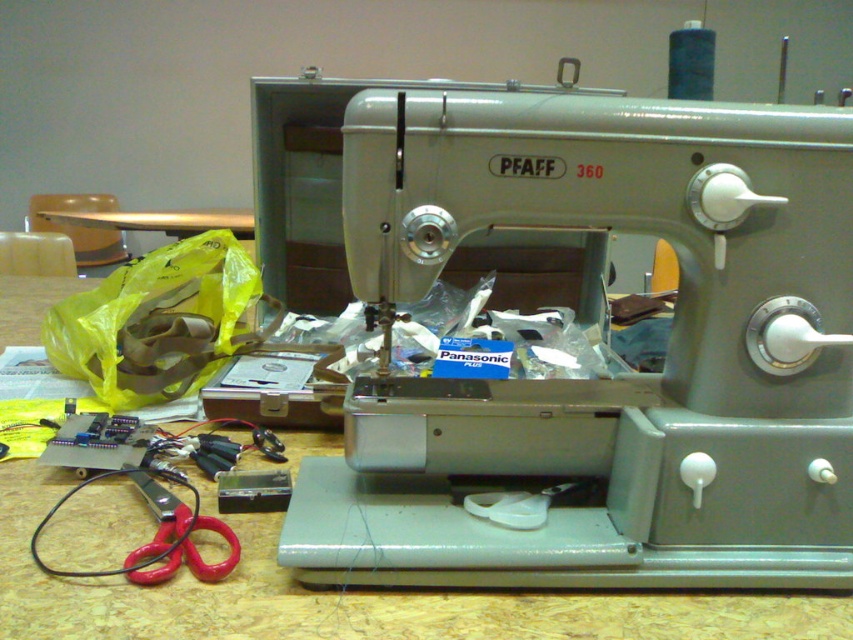
Question: Observing the image, what is the correct spatial positioning of metallic gray sewing machine at center in reference to metallic gold table at upper left?

Choices:
 (A) left
 (B) right

Answer: (B)

Question: Does metallic gray sewing machine at center come behind metallic gold table at upper left?

Choices:
 (A) no
 (B) yes

Answer: (A)

Question: Which object is positioned farthest from the red plastic scissors at lower left?

Choices:
 (A) metallic gold table at upper left
 (B) metallic gray sewing machine at center
 (C) wooden table at center

Answer: (A)

Question: Which is nearer to the red plastic scissors at lower left?

Choices:
 (A) wooden table at center
 (B) metallic gold table at upper left
 (C) metallic gray sewing machine at center

Answer: (A)

Question: Considering the relative positions of metallic gray sewing machine at center and red plastic scissors at lower left in the image provided, where is metallic gray sewing machine at center located with respect to red plastic scissors at lower left?

Choices:
 (A) left
 (B) right

Answer: (B)

Question: Among these objects, which one is nearest to the camera?

Choices:
 (A) metallic gray sewing machine at center
 (B) red plastic scissors at lower left
 (C) metallic gold table at upper left

Answer: (A)